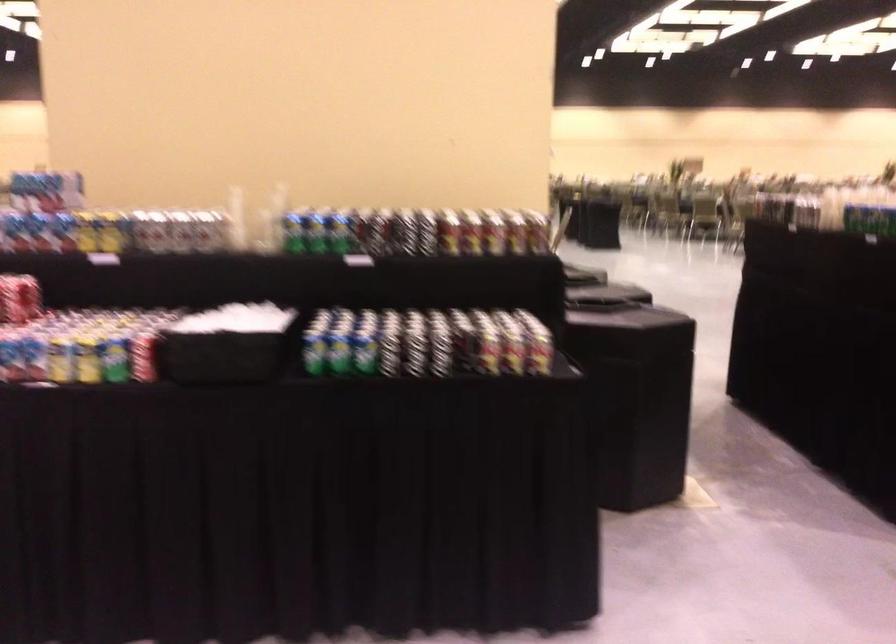
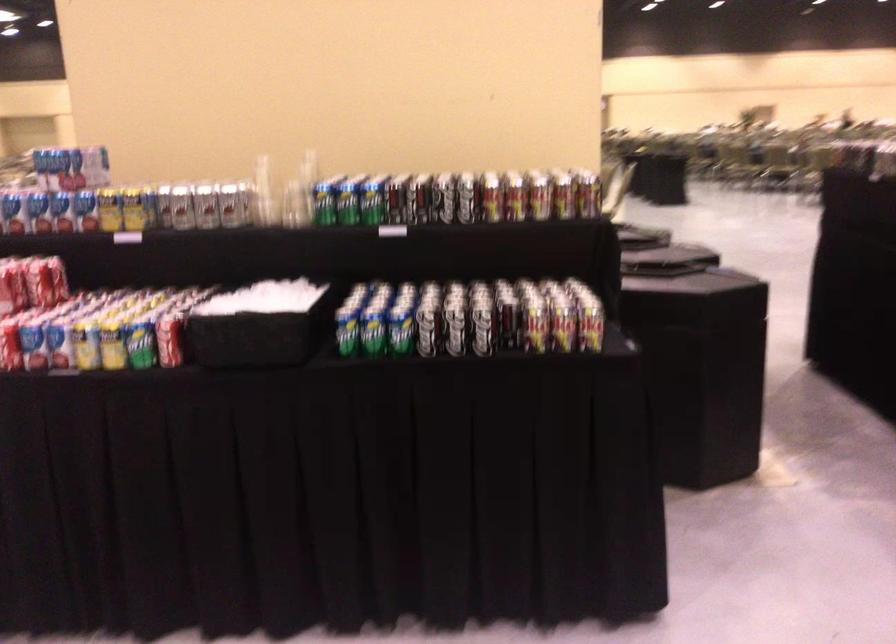
In the second image, find the point that corresponds to [83,231] in the first image.

(108, 210)